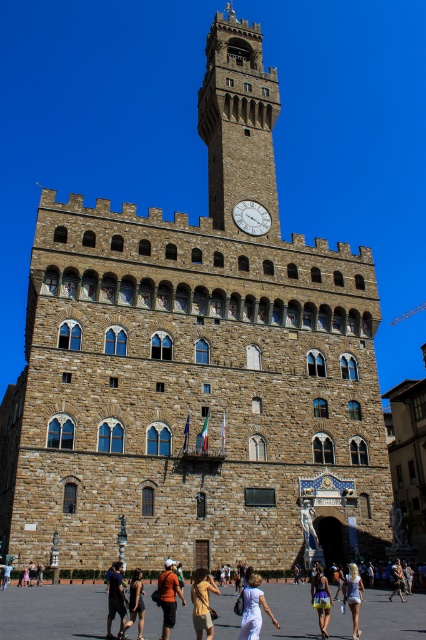
Between white cotton dress at center and white stone clock at center, which one appears on the left side from the viewer's perspective?

white cotton dress at center

The width and height of the screenshot is (426, 640). In order to click on white cotton dress at center in this screenshot , I will do `click(253, 609)`.

Identify the location of white cotton dress at center. (253, 609).

From the picture: Who is shorter, white cotton dress at center or matte yellow shirt at center?

white cotton dress at center

Who is positioned more to the left, white cotton dress at center or matte yellow shirt at center?

Positioned to the left is matte yellow shirt at center.

Locate an element on the screen. Image resolution: width=426 pixels, height=640 pixels. white cotton dress at center is located at coordinates (253, 609).

Image resolution: width=426 pixels, height=640 pixels. What do you see at coordinates (54, 611) in the screenshot?
I see `smooth stone plaza at lower center` at bounding box center [54, 611].

Between smooth stone plaza at lower center and stone clock tower at center, which one is positioned lower?

Positioned lower is smooth stone plaza at lower center.

Who is more distant from viewer, (5, 616) or (210, 125)?

Positioned behind is point (210, 125).

In order to click on smooth stone plaza at lower center in this screenshot , I will do `click(54, 611)`.